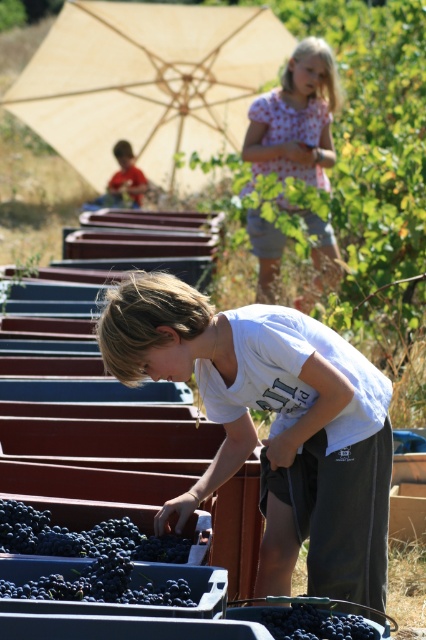
You are a photographer trying to capture a clear shot of the dark purple grapes at lower left without any obstructions. Given that the beige fabric umbrella at upper center is taller than the grapes, how might you position yourself to avoid the umbrella blocking the view?

Since the beige fabric umbrella at upper center is taller than the dark purple grapes at lower left, you should position yourself lower or move closer to the ground to ensure the umbrella does not obstruct the view of the grapes.

What are the coordinates of the white cotton shirt at center?

The white cotton shirt at center is located at coordinates (273, 424).